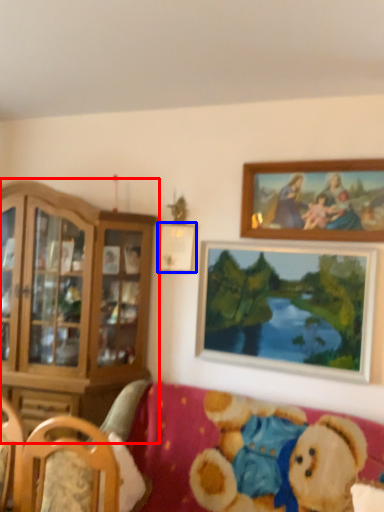
Question: Which point is further to the camera, cabinetry (highlighted by a red box) or picture frame (highlighted by a blue box)?

Choices:
 (A) cabinetry
 (B) picture frame

Answer: (B)